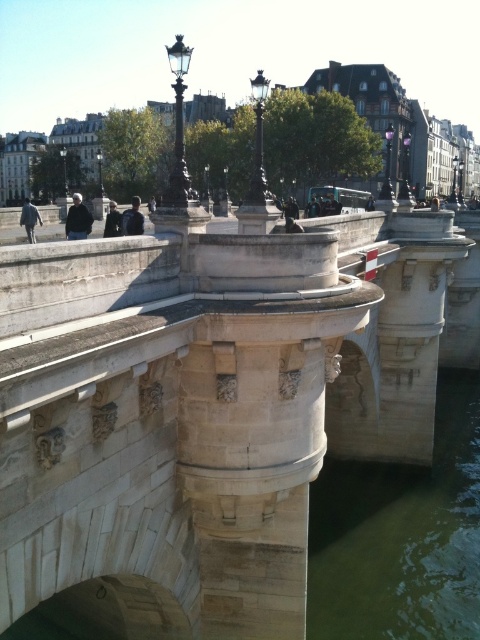
Question: Which point is closer to the camera taking this photo?

Choices:
 (A) (453, 480)
 (B) (46, 305)

Answer: (B)

Question: Does beige stone bridge at center appear over green stone water at lower right?

Choices:
 (A) no
 (B) yes

Answer: (B)

Question: Which of the following is the closest to the observer?

Choices:
 (A) green stone water at lower right
 (B) beige stone bridge at center

Answer: (B)

Question: Is beige stone bridge at center positioned at the back of green stone water at lower right?

Choices:
 (A) no
 (B) yes

Answer: (A)

Question: Does beige stone bridge at center have a smaller size compared to green stone water at lower right?

Choices:
 (A) no
 (B) yes

Answer: (A)